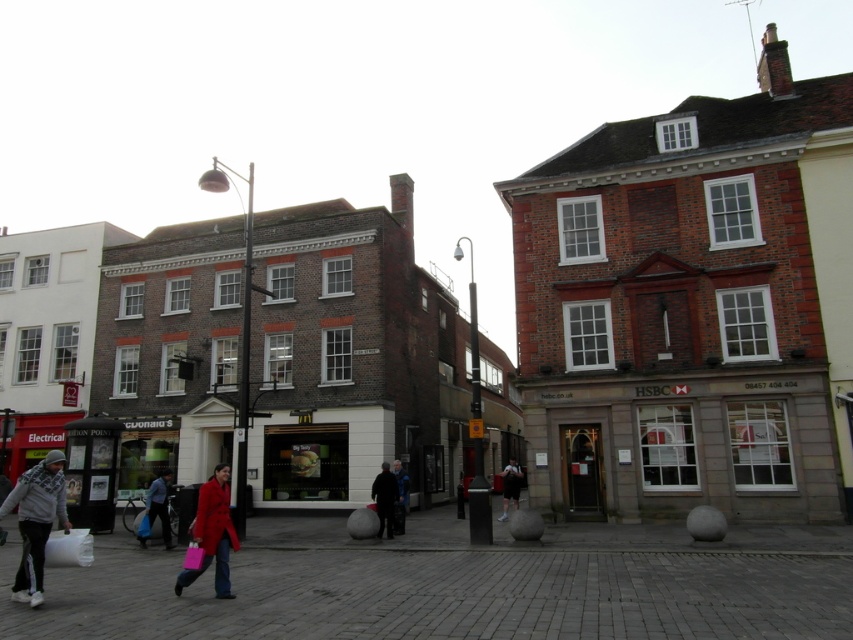
You are standing at the point labeled as point (459,586) in the image. Looking around, you see the white building with a red awning labeled Electrical to your left and the McDonalds restaurant next to it. In the center, there is a three story brick building with dark brown facade and white framed windows. What is the material of the ground you are currently standing on?

The point (459,586) indicates dark gray cobblestone pavement at lower center, so the material of the ground you are currently standing on is dark gray cobblestone pavement.

You are standing at the camera position and see the dark gray jacket at center. If you want to reach the jacket quickly, which direction should you move in relation to the Electrical shop on the left and the McDonalds restaurant?

A: Since the dark gray jacket at center is 113.25 feet away from the camera, you should move straight towards the center of the image, between the Electrical shop on the left and the McDonalds restaurant to reach the jacket quickly.

You are a delivery person standing on the dark gray cobblestone pavement at lower center and need to place a package on the blue fabric coat at lower left. Can you reach the coat from your current position without moving?

The dark gray cobblestone pavement at lower center is much taller than the blue fabric coat at lower left, so you can easily reach the coat from your current position without needing to move.